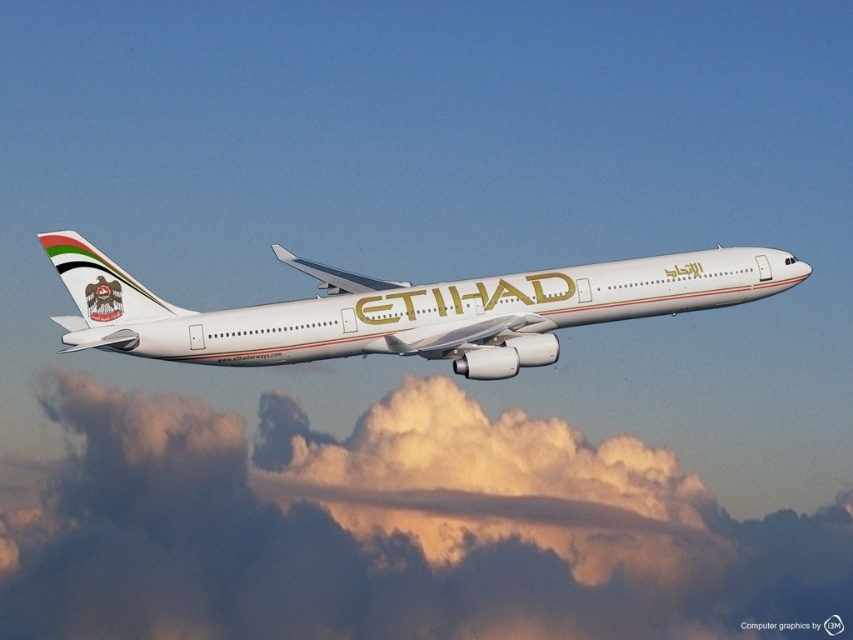
Can you confirm if white fluffy cloud at upper center is wider than white glossy airplane at center?

Yes, white fluffy cloud at upper center is wider than white glossy airplane at center.

Does white fluffy cloud at upper center appear on the left side of white glossy airplane at center?

Incorrect, white fluffy cloud at upper center is not on the left side of white glossy airplane at center.

Which is in front, point (103, 387) or point (665, 296)?

Point (665, 296) is more forward.

This screenshot has width=853, height=640. In order to click on white fluffy cloud at upper center in this screenshot , I will do `click(390, 529)`.